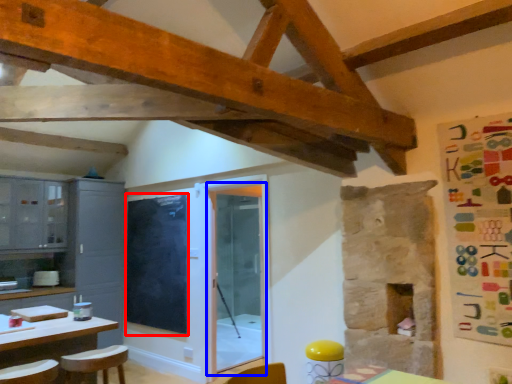
Question: Which object appears closest to the camera in this image, window screen (highlighted by a red box) or glass door (highlighted by a blue box)?

Choices:
 (A) window screen
 (B) glass door

Answer: (B)